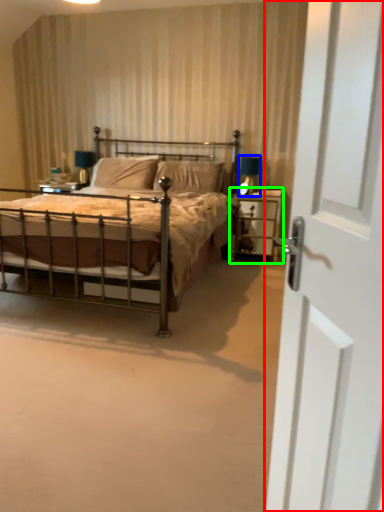
Question: Which is nearer to the door (highlighted by a red box)? table lamp (highlighted by a blue box) or nightstand (highlighted by a green box).

Choices:
 (A) table lamp
 (B) nightstand

Answer: (B)